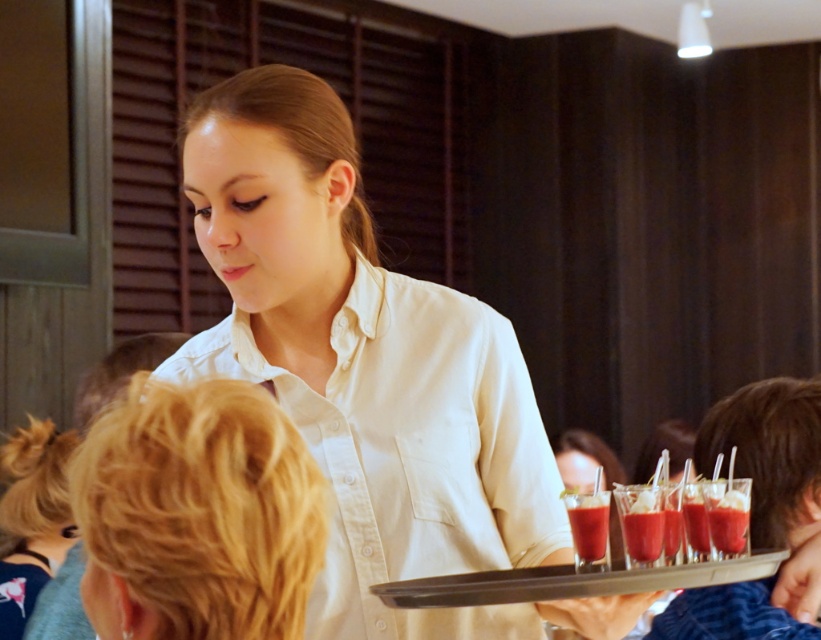
Question: Observing the image, what is the correct spatial positioning of translucent glass cups at lower right in reference to translucent glass beverage at center?

Choices:
 (A) below
 (B) above

Answer: (A)

Question: Which is farther from the translucent glass drink at center?

Choices:
 (A) blonde hair at lower left
 (B) blonde hair at upper left
 (C) translucent glass beverage at center

Answer: (A)

Question: Observing the image, what is the correct spatial positioning of white cotton shirt at center in reference to blonde hair at upper left?

Choices:
 (A) below
 (B) above

Answer: (B)

Question: Considering the relative positions of white cotton shirt at center and translucent glass cups at lower right in the image provided, where is white cotton shirt at center located with respect to translucent glass cups at lower right?

Choices:
 (A) below
 (B) above

Answer: (B)

Question: Considering the real-world distances, which object is closest to the translucent glass cups at lower right?

Choices:
 (A) blonde hair at upper left
 (B) translucent glass drink at center

Answer: (B)

Question: Which object appears closest to the camera in this image?

Choices:
 (A) translucent glass drink at center
 (B) white cotton shirt at center
 (C) blonde hair at upper left

Answer: (C)